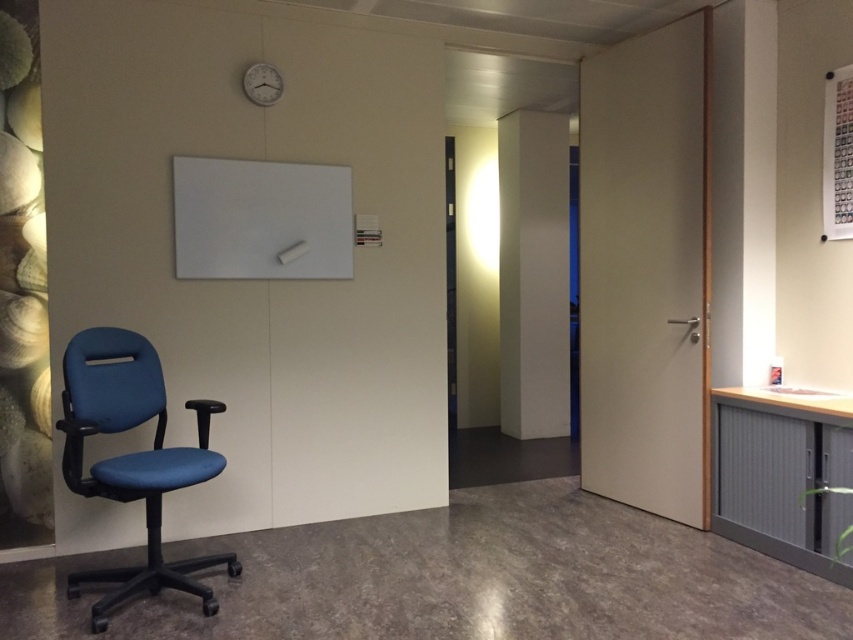
You are sitting in the blue fabric swivel chair at left and want to look at the metallic silver clock at upper center. Which direction should you turn your head to see it?

The blue fabric swivel chair at left is in front of the metallic silver clock at upper center, so you would need to look upward to see the clock since it is above you.